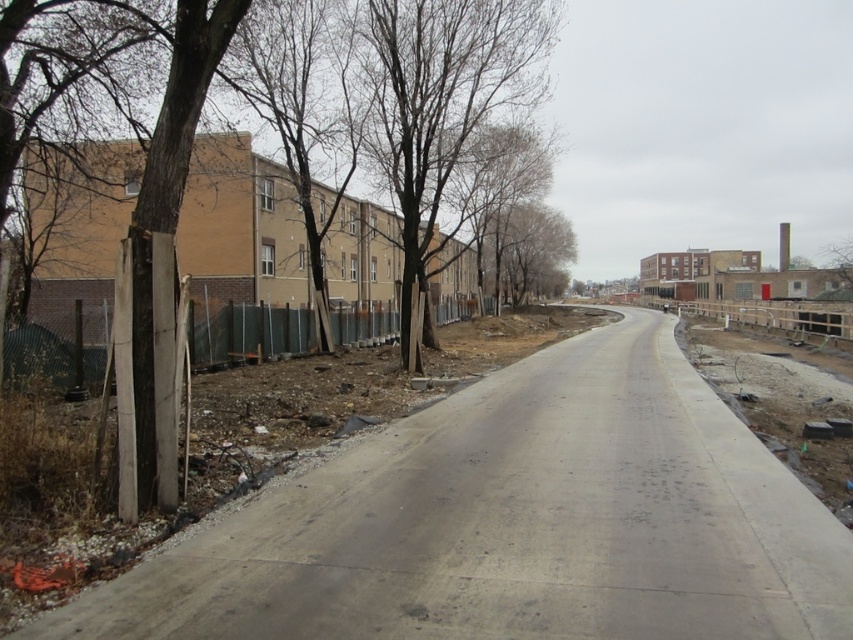
You are a delivery driver approaching the newly paved road and need to navigate around the gray concrete alley at left and the wooden fence at left. Which of these two objects is closer to your vehicle as you drive along the road?

The gray concrete alley at left is closer to the viewer than the wooden fence at left, so the gray concrete alley at left would be closer to your vehicle as you drive along the road.

You are a delivery person trying to navigate through the gray concrete alley at left and the wooden fence at left. Which path would allow you to carry a wider package?

The wooden fence at left is larger in size than the gray concrete alley at left, so the wooden fence at left would allow a wider package to pass through.

You are a delivery driver who needs to park your vehicle on the newly paved road. The vehicle requires a parking space of at least 15 meters in length. Based on the scene, can you determine if the space between the wooden fence at left and the bare branches at center is sufficient for parking?

The distance between the wooden fence at left and the bare branches at center is 17.39 meters, which is longer than the required 15 meters. Therefore, the space between them is sufficient for parking the vehicle.